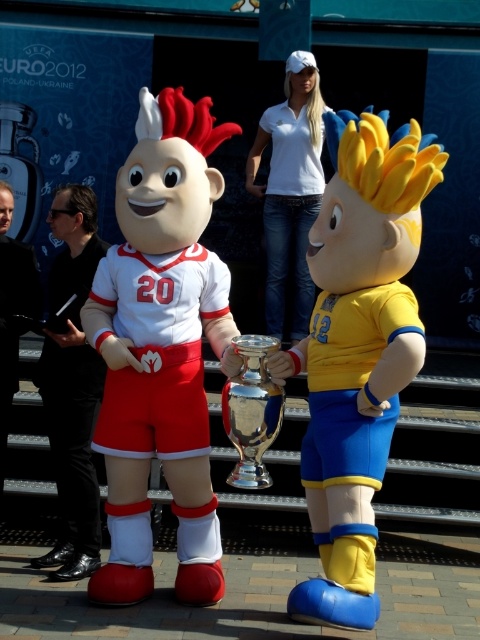
Can you confirm if black shiny suit at left is positioned below white cotton shirt at upper center?

Yes, black shiny suit at left is below white cotton shirt at upper center.

Does point (83, 257) lie in front of point (299, 60)?

Yes.

Find the location of a particular element. black shiny suit at left is located at coordinates click(x=72, y=385).

Can you confirm if white cotton shirt at upper center is shorter than black leather jacket at left?

Incorrect, white cotton shirt at upper center's height does not fall short of black leather jacket at left's.

Is white cotton shirt at upper center closer to camera compared to black leather jacket at left?

That is False.

Locate an element on the screen. Image resolution: width=480 pixels, height=640 pixels. white cotton shirt at upper center is located at coordinates (289, 188).

Does matte white mascot at center have a greater width compared to shiny silver trophy at center?

Correct, the width of matte white mascot at center exceeds that of shiny silver trophy at center.

Does matte white mascot at center appear on the left side of shiny silver trophy at center?

Correct, you'll find matte white mascot at center to the left of shiny silver trophy at center.

Is point (227, 291) farther from camera compared to point (239, 435)?

Yes, point (227, 291) is farther from viewer.

Where is `matte white mascot at center`? The height and width of the screenshot is (640, 480). matte white mascot at center is located at coordinates [x=160, y=348].